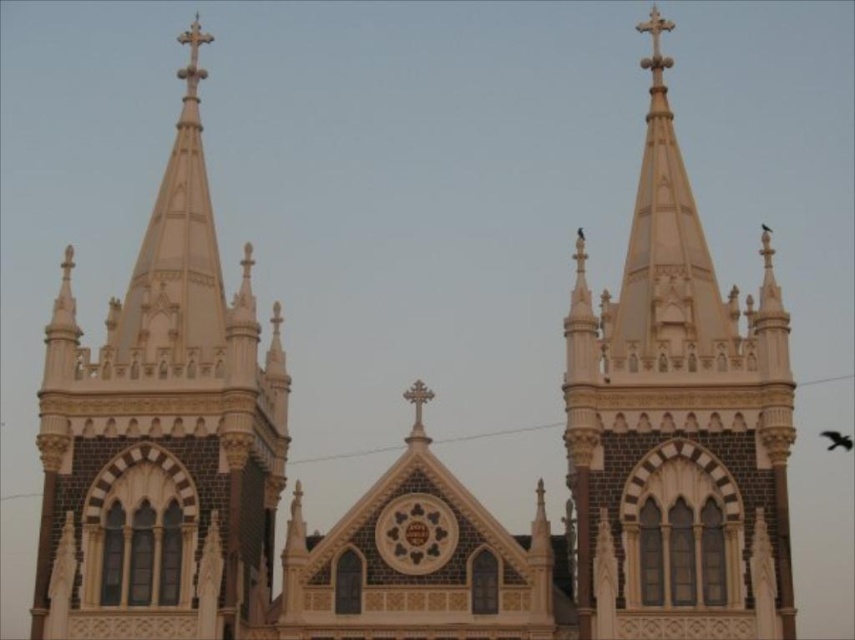
Does white stone spire at center have a greater height compared to white stone steeple at upper center?

Yes, white stone spire at center is taller than white stone steeple at upper center.

Is point (175, 432) positioned in front of point (752, 314)?

Yes.

Identify the location of white stone spire at center. The image size is (855, 640). (162, 433).

The image size is (855, 640). Identify the location of white stone spire at center. (162, 433).